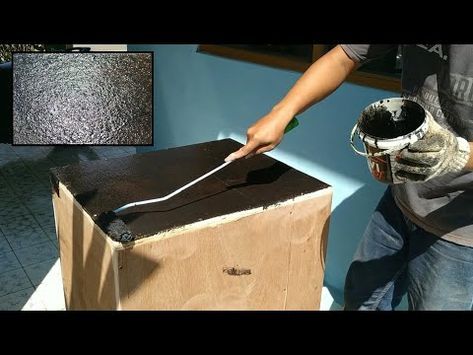
This screenshot has height=355, width=473. Find the location of `table sides`. table sides is located at coordinates (93, 253), (160, 269), (148, 216).